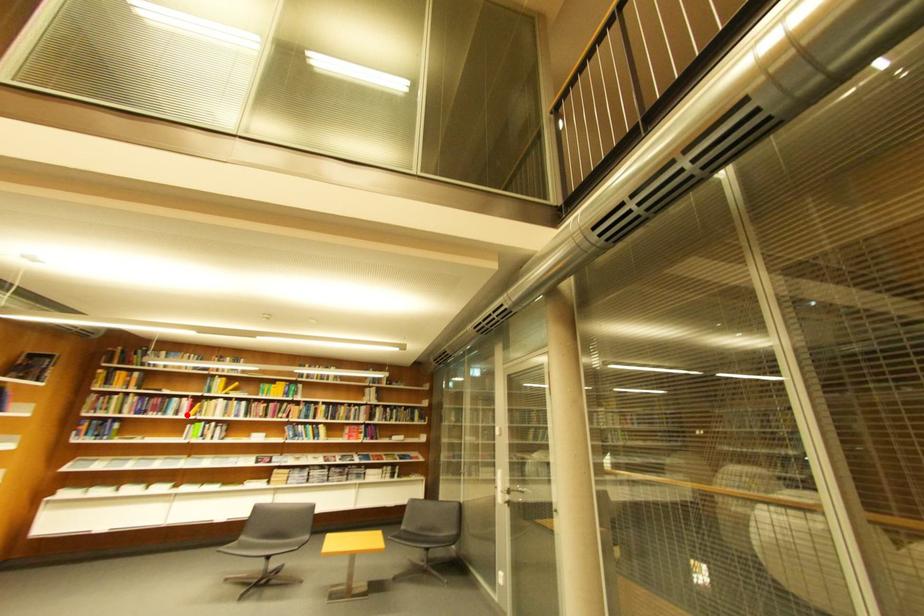
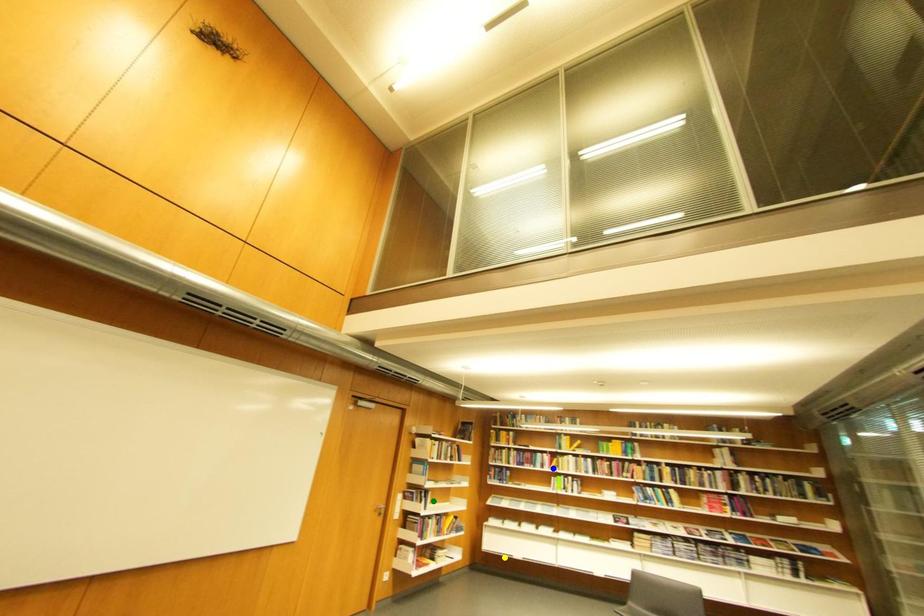
Question: I am providing you with two images of the same scene from different viewpoints. A red point is marked on the first image. You are given multiple points on the second image. In image 2, which mark is for the same physical point as the one in image 1?

Choices:
 (A) blue point
 (B) green point
 (C) yellow point

Answer: (A)